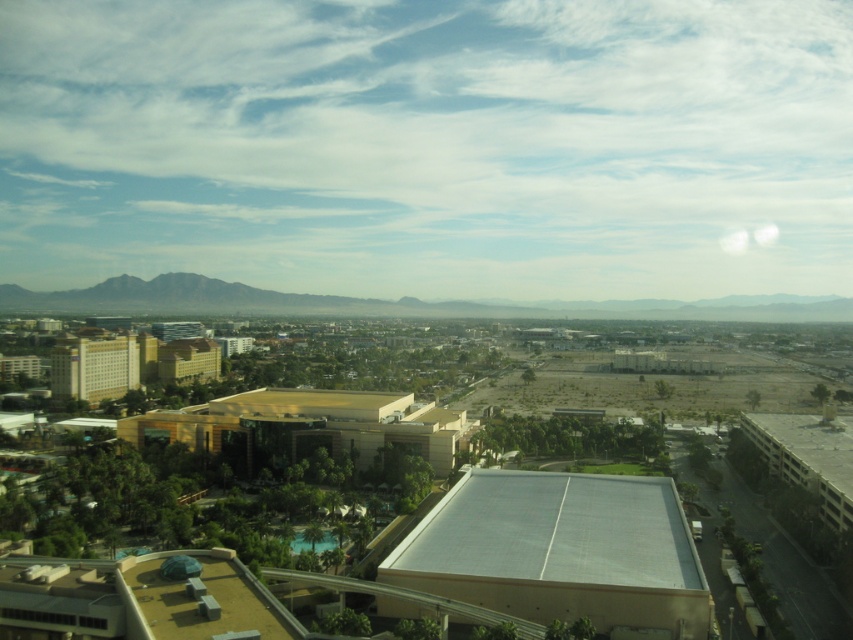
In the scene shown: Is gray concrete parking garage at lower right to the right of beige concrete hotel at left from the viewer's perspective?

Yes, gray concrete parking garage at lower right is to the right of beige concrete hotel at left.

Is point (784, 465) farther from camera compared to point (76, 369)?

No.

At what (x,y) coordinates should I click in order to perform the action: click on gray concrete parking garage at lower right. Please return your answer as a coordinate pair (x, y). Looking at the image, I should click on (808, 456).

Measure the distance between point (576, 572) and camera.

Point (576, 572) and camera are 110.91 meters apart from each other.

Can you confirm if white matte roof at center is positioned below beige concrete hotel at left?

Correct, white matte roof at center is located below beige concrete hotel at left.

Is point (596, 524) closer to viewer compared to point (71, 336)?

Yes, it is.

At what (x,y) coordinates should I click in order to perform the action: click on white matte roof at center. Please return your answer as a coordinate pair (x, y). Image resolution: width=853 pixels, height=640 pixels. Looking at the image, I should click on (560, 550).

Who is lower down, beige concrete hotel at left or beige concrete building at center?

beige concrete hotel at left

Between beige concrete hotel at left and beige concrete building at center, which one appears on the left side from the viewer's perspective?

beige concrete hotel at left

Locate an element on the screen. Image resolution: width=853 pixels, height=640 pixels. beige concrete hotel at left is located at coordinates (94, 365).

Image resolution: width=853 pixels, height=640 pixels. What are the coordinates of `beige concrete hotel at left` in the screenshot? It's located at (94, 365).